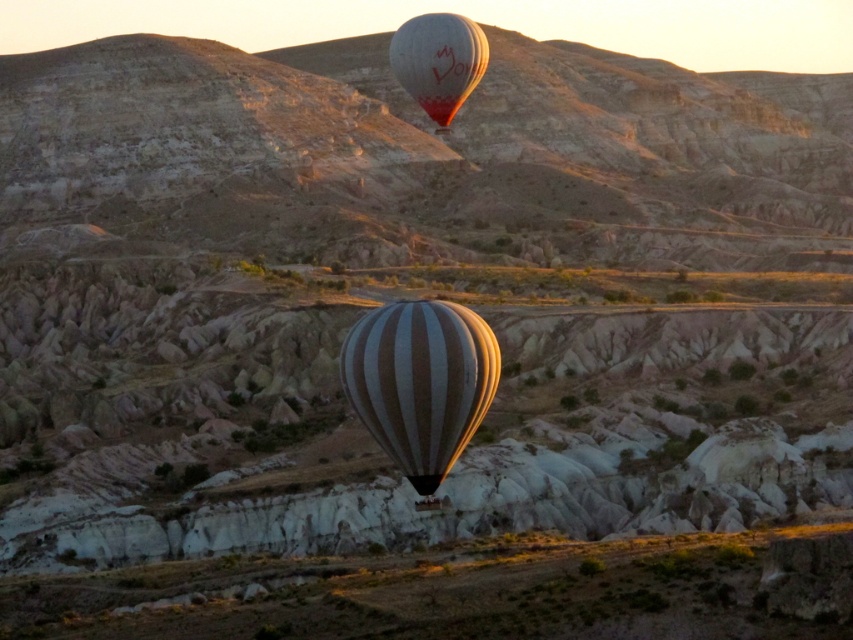
You are a passenger in one of the hot air balloons and want to determine which balloon is lower. You see both the striped fabric balloon at center and the white striped balloon at upper center. Which one is positioned lower in the sky?

The striped fabric balloon at center is positioned lower in the sky than the white striped balloon at upper center.

You are standing in the landscape scene and want to reach the point at coordinates point (369, 368). The distance from you to this point is 126.87 meters. If you walk towards it at a speed of 3 meters per minute, how many minutes will it take you to reach the point?

To reach the point (369, 368), which is 126.87 meters away, at a speed of 3 meters per minute, you would need 126.87 divided by 3 equals approximately 42.29 minutes. So it will take about 42.3 minutes.